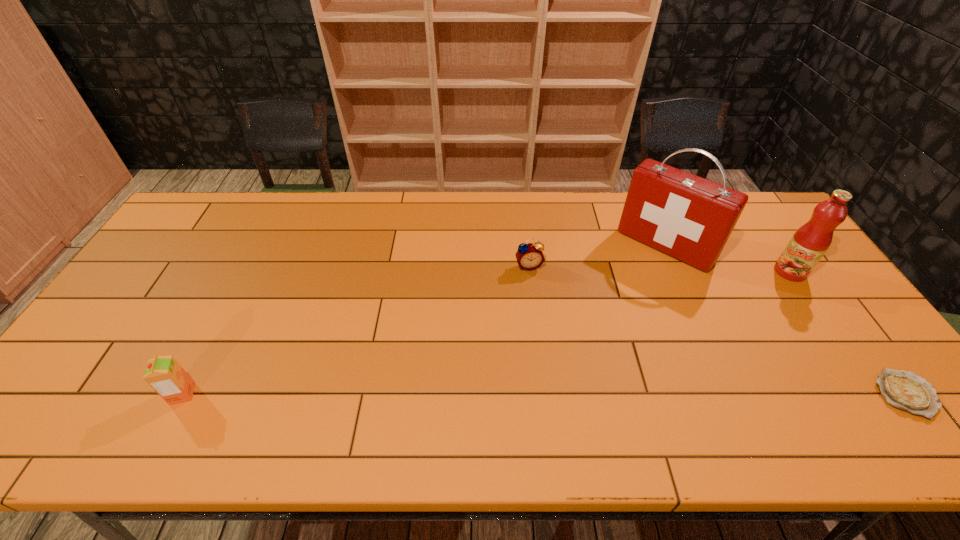
Find the location of `object that can be found as the closest to the third object from left to right`. object that can be found as the closest to the third object from left to right is located at coordinates (809, 243).

I want to click on object that is the third closest to the shortest object, so click(x=529, y=256).

You are a GUI agent. You are given a task and a screenshot of the screen. Output one action in this format:
    pyautogui.click(x=<x>, y=<y>)
    Task: Click on the free location that satisfies the following two spatial constraints: 1. on the back side of the orange juice; 2. on the right side of the fruit juice
    This screenshot has height=540, width=960.
    Given the screenshot: What is the action you would take?
    pyautogui.click(x=246, y=272)

Find the location of `free location that satisfies the following two spatial constraints: 1. on the front side of the third object from left to right; 2. on the right side of the shortest object`. free location that satisfies the following two spatial constraints: 1. on the front side of the third object from left to right; 2. on the right side of the shortest object is located at coordinates (730, 394).